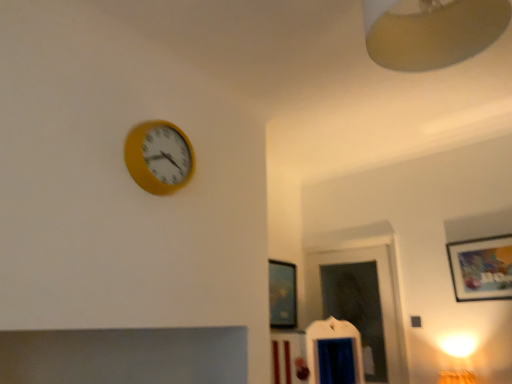
Question: Would you say matte beige lampshade at upper right is inside or outside matte wooden picture frame at upper right, which is counted as the 1th picture frame, starting from the front?

Choices:
 (A) outside
 (B) inside

Answer: (A)

Question: From the image's perspective, is matte beige lampshade at upper right located above or below matte wooden picture frame at upper right, which is counted as the 1th picture frame, starting from the front?

Choices:
 (A) above
 (B) below

Answer: (A)

Question: Considering the real-world distances, which object is closest to the matte black picture frame at center, marked as the 2th picture frame in a right-to-left arrangement?

Choices:
 (A) matte beige lampshade at upper right
 (B) yellow matte clock at upper left
 (C) matte wooden picture frame at upper right, the 2th picture frame in the back-to-front sequence

Answer: (C)

Question: Which of these objects is positioned farthest from the matte black picture frame at center, which is the first picture frame from back to front?

Choices:
 (A) matte wooden picture frame at upper right, the second picture frame when ordered from left to right
 (B) matte beige lampshade at upper right
 (C) yellow matte clock at upper left

Answer: (B)